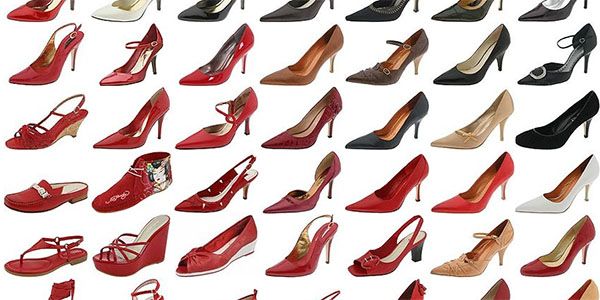
Identify the location of 3rd row of shoes in image. (43, 130), (125, 133), (213, 135), (278, 137), (369, 140), (465, 138), (537, 138).